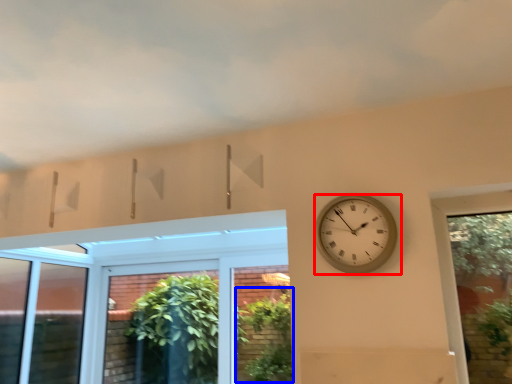
Question: Among these objects, which one is farthest to the camera, wall clock (highlighted by a red box) or plant (highlighted by a blue box)?

Choices:
 (A) wall clock
 (B) plant

Answer: (B)